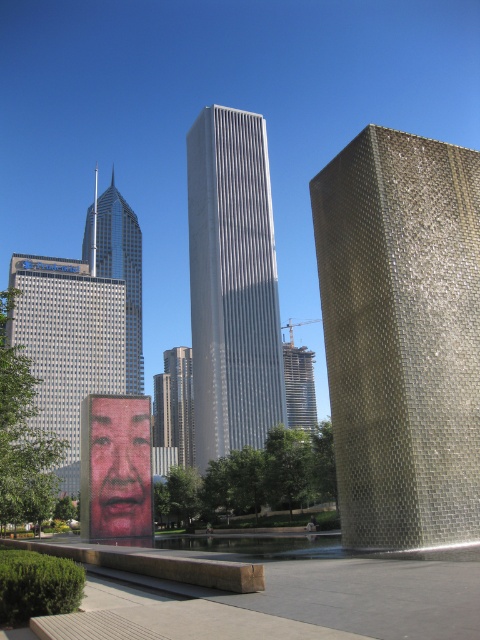
Is pink matte face at center bigger than glassy steel skyscraper at center?

No, pink matte face at center is not bigger than glassy steel skyscraper at center.

Does pink matte face at center have a lesser height compared to glassy steel skyscraper at center?

Yes.

Is point (140, 508) closer to viewer compared to point (312, 358)?

That is True.

In order to click on pink matte face at center in this screenshot , I will do `click(120, 467)`.

Is point (175, 419) positioned in front of point (288, 362)?

Yes, point (175, 419) is closer to viewer.

Who is more distant from viewer, (164, 369) or (286, 355)?

The point (164, 369) is behind.

Who is more distant from viewer, (181,433) or (311,422)?

Point (181,433)

What are the coordinates of `reflective glass skyscraper at center` in the screenshot? It's located at (173, 408).

Describe the element at coordinates (231, 284) in the screenshot. I see `silver glass skyscraper at center` at that location.

Does silver glass skyscraper at center lie behind pink matte face at center?

That is True.

Between point (252, 129) and point (105, 483), which one is positioned in front?

Positioned in front is point (105, 483).

This screenshot has width=480, height=640. I want to click on silver glass skyscraper at center, so click(231, 284).